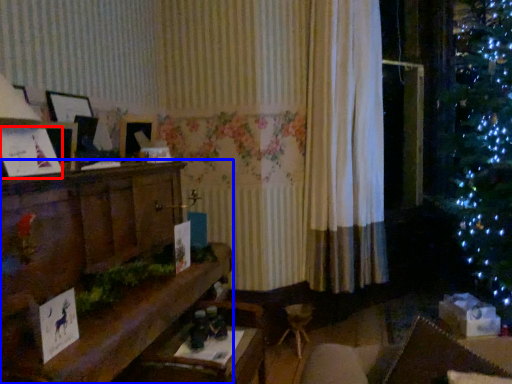
Question: Which point is further to the camera, christmas card (highlighted by a red box) or furniture (highlighted by a blue box)?

Choices:
 (A) christmas card
 (B) furniture

Answer: (A)